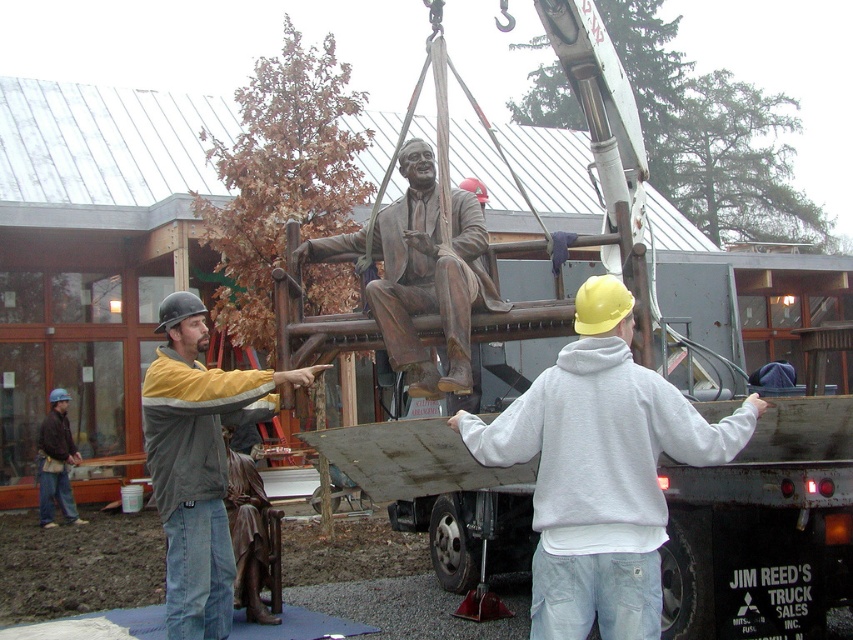
You are a delivery driver who needs to secure both the white matte hoodie at center and the bronze statue at center in the back of your truck. Based on their sizes, which item should you place first to maximize space efficiency?

Since the white matte hoodie at center might be wider than the bronze statue at center, you should place the bronze statue at center first to allow the wider hoodie to fit properly.